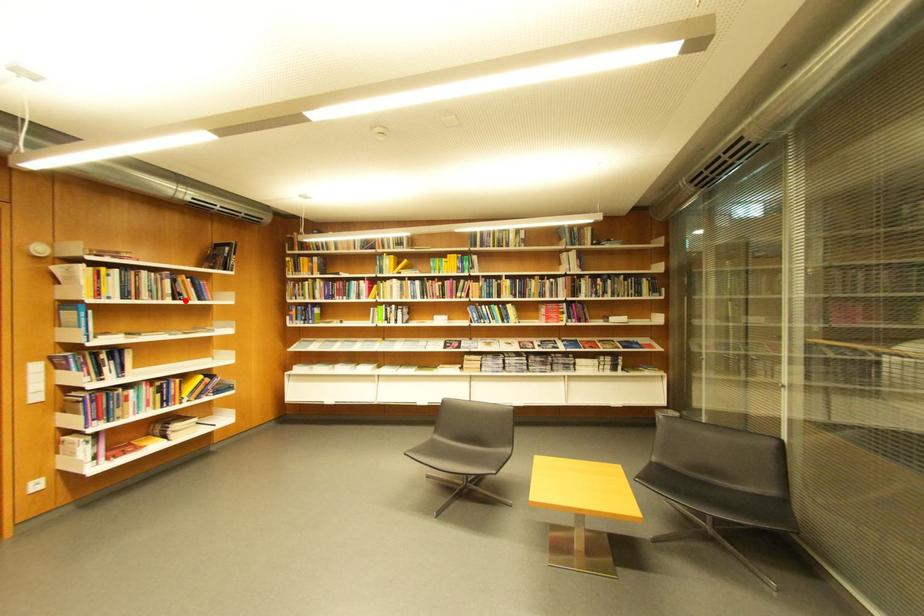
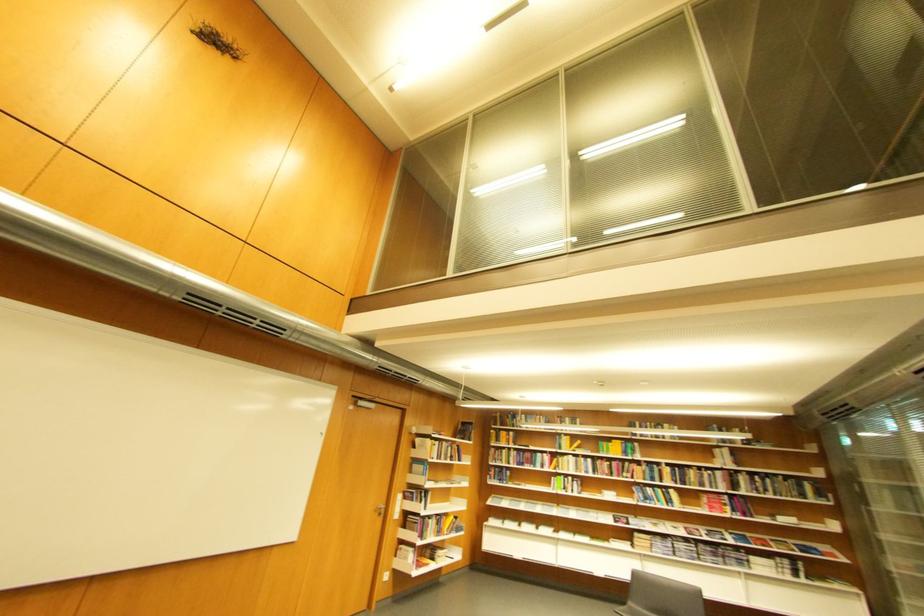
Question: I am providing you with two images of the same scene from different viewpoints. A red point is shown in image1. For the corresponding object point in image2, is it positioned nearer or farther from the camera?

Choices:
 (A) Nearer
 (B) Farther

Answer: (B)